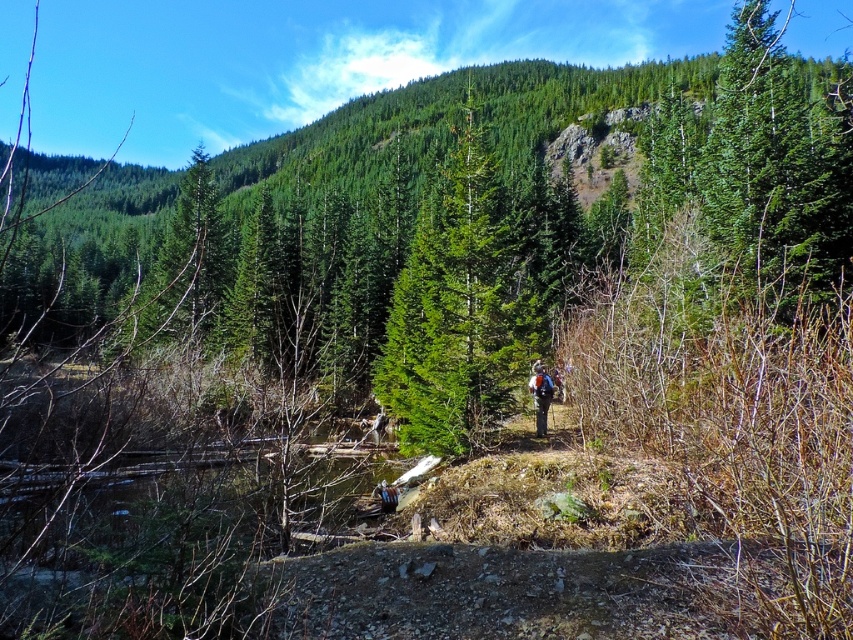
Question: Is green matte tree at center wider than camouflage backpack at center?

Choices:
 (A) no
 (B) yes

Answer: (B)

Question: Which point is closer to the camera taking this photo?

Choices:
 (A) (532, 380)
 (B) (419, 360)

Answer: (A)

Question: Is green matte tree at center below camouflage backpack at center?

Choices:
 (A) no
 (B) yes

Answer: (A)

Question: In this image, where is green matte tree at center located relative to camouflage backpack at center?

Choices:
 (A) below
 (B) above

Answer: (B)